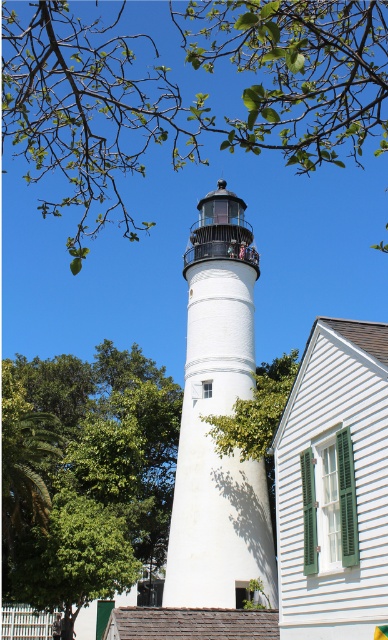
Question: Which object appears farthest from the camera in this image?

Choices:
 (A) green leafy tree at upper center
 (B) green leafy tree at center

Answer: (B)

Question: Which point appears farthest from the camera in this image?

Choices:
 (A) (247, 33)
 (B) (69, 396)
 (C) (216, 547)

Answer: (B)

Question: Where is green leafy tree at upper center located in relation to white matte/lightweight tower at center in the image?

Choices:
 (A) left
 (B) right

Answer: (B)

Question: In this image, where is green leafy tree at center located relative to white matte/lightweight tower at center?

Choices:
 (A) right
 (B) left

Answer: (B)

Question: Is green leafy tree at center to the left of white matte/lightweight tower at center from the viewer's perspective?

Choices:
 (A) no
 (B) yes

Answer: (B)

Question: Among these points, which one is nearest to the camera?

Choices:
 (A) (211, 449)
 (B) (97, 189)

Answer: (A)